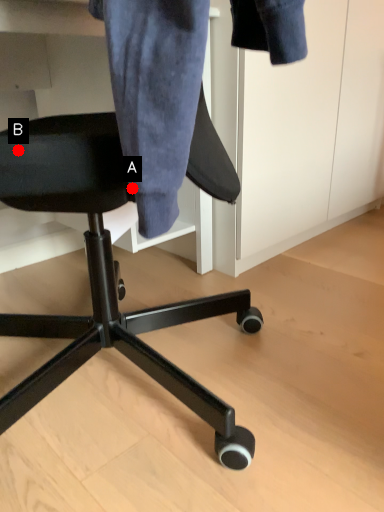
Question: Two points are circled on the image, labeled by A and B beside each circle. Which of the following is the closest to the observer?

Choices:
 (A) A is closer
 (B) B is closer

Answer: (A)